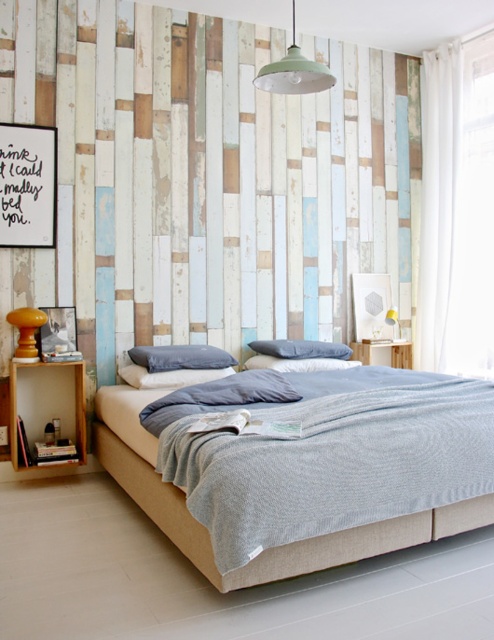
Question: Can you confirm if green matte pendant light at upper center is bigger than dark gray fabric pillow at center?

Choices:
 (A) no
 (B) yes

Answer: (A)

Question: Is blue soft pillow at center wider than blue cotton pillow at center?

Choices:
 (A) no
 (B) yes

Answer: (A)

Question: Which object is the closest to the dark gray fabric pillow at center?

Choices:
 (A) blue soft pillow at center
 (B) blue cotton pillow at center

Answer: (B)

Question: Considering the relative positions of light beige fabric bed at center and green matte pendant light at upper center in the image provided, where is light beige fabric bed at center located with respect to green matte pendant light at upper center?

Choices:
 (A) right
 (B) left

Answer: (A)

Question: Which of the following is the closest to the observer?

Choices:
 (A) (275, 353)
 (B) (228, 365)

Answer: (B)

Question: Which of the following is the closest to the observer?

Choices:
 (A) blue cotton pillow at center
 (B) light beige fabric bed at center

Answer: (B)